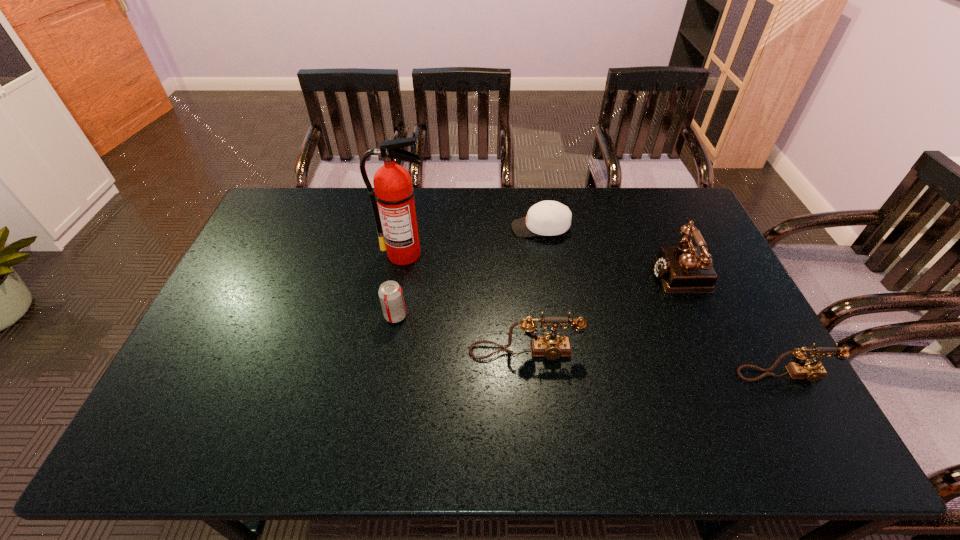
Identify the location of the leftmost telephone. (552, 346).

This screenshot has width=960, height=540. Find the location of `the second nearest telephone`. the second nearest telephone is located at coordinates (552, 346).

Locate an element on the screen. the nearest object is located at coordinates (802, 368).

Where is `the shortest telephone`? the shortest telephone is located at coordinates (802, 368).

Find the location of a particular element. The width and height of the screenshot is (960, 540). the farthest object is located at coordinates (548, 218).

The image size is (960, 540). What are the coordinates of `the farthest telephone` in the screenshot? It's located at (685, 269).

This screenshot has height=540, width=960. What are the coordinates of `soda can` in the screenshot? It's located at (390, 293).

This screenshot has width=960, height=540. In order to click on fire extinguisher in this screenshot , I will do `click(393, 190)`.

Image resolution: width=960 pixels, height=540 pixels. Identify the location of free space located on the front-facing side of the third tallest object. [x=528, y=383].

Locate an element on the screen. This screenshot has height=540, width=960. vacant point located on the front-facing side of the nearest object is located at coordinates (801, 406).